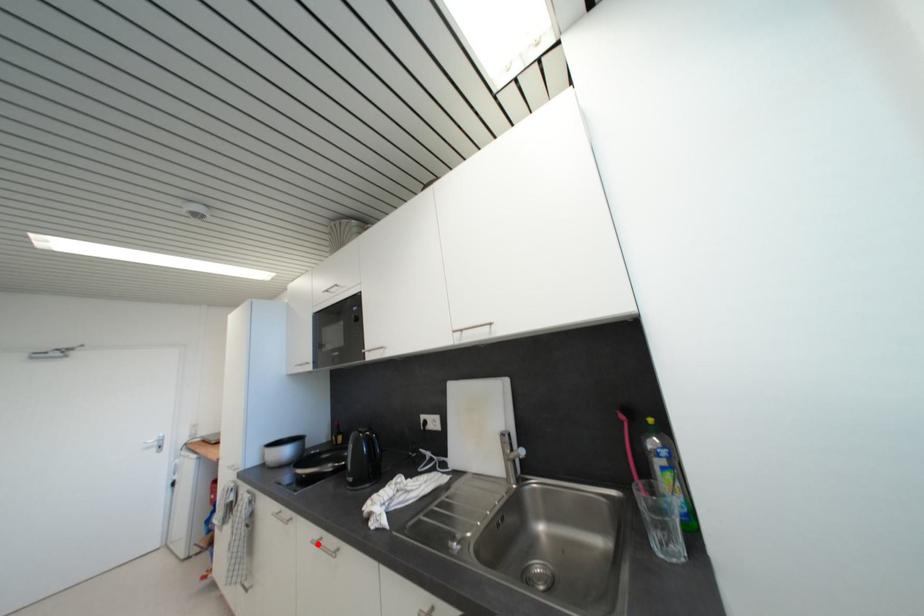
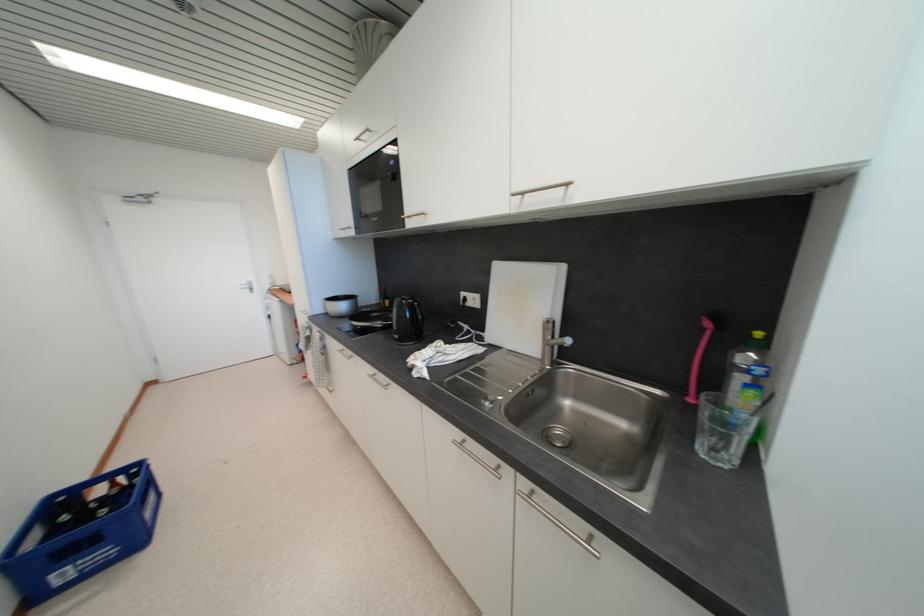
The point at the highlighted location is marked in the first image. Where is the corresponding point in the second image?

(373, 378)